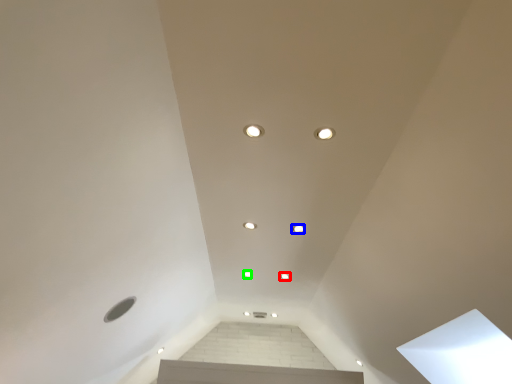
Question: Which is nearer to the dot (highlighted by a red box)? dot (highlighted by a blue box) or dot (highlighted by a green box).

Choices:
 (A) dot
 (B) dot

Answer: (B)